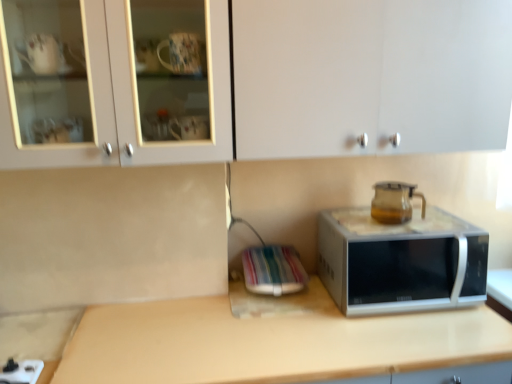
What do you see at coordinates (258, 342) in the screenshot? The width and height of the screenshot is (512, 384). I see `beige laminate countertop at center` at bounding box center [258, 342].

Describe the element at coordinates (394, 202) in the screenshot. Image resolution: width=512 pixels, height=384 pixels. I see `transparent glass coffeepot at upper right` at that location.

You are a GUI agent. You are given a task and a screenshot of the screen. Output one action in this format:
    pyautogui.click(x=<x>, y=<y>)
    Task: Click on the white glossy cabinet at upper center
    
    Given the screenshot: What is the action you would take?
    coord(254,79)

From the image's perspective, is beige laminate countertop at center under transparent glass coffeepot at upper right?

Yes, from the image's perspective, beige laminate countertop at center is beneath transparent glass coffeepot at upper right.

Between beige laminate countertop at center and transparent glass coffeepot at upper right, which one is positioned in front?

beige laminate countertop at center is closer to the camera.

Is transparent glass coffeepot at upper right at the back of beige laminate countertop at center?

beige laminate countertop at center does not have its back to transparent glass coffeepot at upper right.

What's the angular difference between white glossy cabinet at upper center and transparent glass coffeepot at upper right's facing directions?

2 degrees separate the facing orientations of white glossy cabinet at upper center and transparent glass coffeepot at upper right.

Which of these two, white glossy cabinet at upper center or transparent glass coffeepot at upper right, is smaller?

Smaller between the two is transparent glass coffeepot at upper right.

Based on the photo, considering their positions, is white glossy cabinet at upper center located in front of or behind transparent glass coffeepot at upper right?

Visually, white glossy cabinet at upper center is located in front of transparent glass coffeepot at upper right.

Which point is more forward, (x=277, y=30) or (x=406, y=205)?

The point (x=277, y=30) is in front.

Is beige laminate countertop at center to the right of silver metallic microwave at center from the viewer's perspective?

Incorrect, beige laminate countertop at center is not on the right side of silver metallic microwave at center.

Can you confirm if beige laminate countertop at center is taller than silver metallic microwave at center?

Correct, beige laminate countertop at center is much taller as silver metallic microwave at center.

From the image's perspective, which is above, beige laminate countertop at center or silver metallic microwave at center?

silver metallic microwave at center.

Looking at their sizes, would you say beige laminate countertop at center is wider or thinner than silver metallic microwave at center?

beige laminate countertop at center is wider than silver metallic microwave at center.

Consider the image. In the image, is white glossy cabinet at upper center on the left side or the right side of silver metallic microwave at center?

From the image, it's evident that white glossy cabinet at upper center is to the left of silver metallic microwave at center.

From the image's perspective, is white glossy cabinet at upper center below silver metallic microwave at center?

Actually, white glossy cabinet at upper center appears above silver metallic microwave at center in the image.

Is white glossy cabinet at upper center next to silver metallic microwave at center and touching it?

No.

Between white glossy cabinet at upper center and silver metallic microwave at center, which one is positioned in front?

white glossy cabinet at upper center is in front.

From the image's perspective, is transparent glass coffeepot at upper right on white glossy cabinet at upper center?

No, from the image's perspective, transparent glass coffeepot at upper right is not over white glossy cabinet at upper center.

Can you tell me how much transparent glass coffeepot at upper right and white glossy cabinet at upper center differ in facing direction?

There is a 2-degree angle between the facing directions of transparent glass coffeepot at upper right and white glossy cabinet at upper center.

Which object is closer to the camera, transparent glass coffeepot at upper right or white glossy cabinet at upper center?

white glossy cabinet at upper center is in front.

From a real-world perspective, is transparent glass coffeepot at upper right physically located above or below white glossy cabinet at upper center?

From a real-world perspective, transparent glass coffeepot at upper right is physically below white glossy cabinet at upper center.

Does transparent glass coffeepot at upper right have a lesser height compared to silver metallic microwave at center?

Correct, transparent glass coffeepot at upper right is not as tall as silver metallic microwave at center.

You are a GUI agent. You are given a task and a screenshot of the screen. Output one action in this format:
    pyautogui.click(x=<x>, y=<y>)
    Task: Click on the microwave oven that is under the transparent glass coffeepot at upper right (from a real-world perspective)
    This screenshot has width=512, height=384.
    Given the screenshot: What is the action you would take?
    pyautogui.click(x=401, y=261)

Is transparent glass coffeepot at upper right placed right next to silver metallic microwave at center?

No, transparent glass coffeepot at upper right is not beside silver metallic microwave at center.

From a real-world perspective, which object rests below the other?

In real-world perspective, silver metallic microwave at center is lower.

Does silver metallic microwave at center have a smaller size compared to transparent glass coffeepot at upper right?

Actually, silver metallic microwave at center might be larger than transparent glass coffeepot at upper right.

Is silver metallic microwave at center spatially inside transparent glass coffeepot at upper right, or outside of it?

silver metallic microwave at center is not enclosed by transparent glass coffeepot at upper right.

This screenshot has width=512, height=384. Find the location of `microwave oven on the right of transparent glass coffeepot at upper right`. microwave oven on the right of transparent glass coffeepot at upper right is located at coordinates 401,261.

Consider the image. Is silver metallic microwave at center aimed at transparent glass coffeepot at upper right?

No, silver metallic microwave at center is not turned towards transparent glass coffeepot at upper right.

Locate an element on the screen. countertop below the transparent glass coffeepot at upper right (from a real-world perspective) is located at coordinates (258, 342).

Where is `coffeepot located below the white glossy cabinet at upper center (from the image's perspective)`? coffeepot located below the white glossy cabinet at upper center (from the image's perspective) is located at coordinates (394, 202).

From the image, which object appears to be farther from white glossy cabinet at upper center, beige laminate countertop at center or silver metallic microwave at center?

beige laminate countertop at center lies further to white glossy cabinet at upper center than the other object.

Estimate the real-world distances between objects in this image. Which object is further from beige laminate countertop at center, white glossy cabinet at upper center or silver metallic microwave at center?

white glossy cabinet at upper center is further to beige laminate countertop at center.

Based on their spatial positions, is white glossy cabinet at upper center or silver metallic microwave at center closer to transparent glass coffeepot at upper right?

silver metallic microwave at center is closer to transparent glass coffeepot at upper right.

Estimate the real-world distances between objects in this image. Which object is closer to beige laminate countertop at center, transparent glass coffeepot at upper right or white glossy cabinet at upper center?

transparent glass coffeepot at upper right lies closer to beige laminate countertop at center than the other object.

From the image, which object appears to be nearer to transparent glass coffeepot at upper right, silver metallic microwave at center or white glossy cabinet at upper center?

silver metallic microwave at center.

Estimate the real-world distances between objects in this image. Which object is closer to transparent glass coffeepot at upper right, beige laminate countertop at center or silver metallic microwave at center?

The object closer to transparent glass coffeepot at upper right is silver metallic microwave at center.

Consider the image. Looking at the image, which one is located further to white glossy cabinet at upper center, silver metallic microwave at center or transparent glass coffeepot at upper right?

transparent glass coffeepot at upper right is positioned further to the anchor white glossy cabinet at upper center.

Based on their spatial positions, is transparent glass coffeepot at upper right or silver metallic microwave at center further from beige laminate countertop at center?

transparent glass coffeepot at upper right.

Where is `coffeepot between white glossy cabinet at upper center and beige laminate countertop at center in the up-down direction`? coffeepot between white glossy cabinet at upper center and beige laminate countertop at center in the up-down direction is located at coordinates (394, 202).

Image resolution: width=512 pixels, height=384 pixels. Find the location of `coffeepot between white glossy cabinet at upper center and silver metallic microwave at center in the horizontal direction`. coffeepot between white glossy cabinet at upper center and silver metallic microwave at center in the horizontal direction is located at coordinates (394, 202).

The height and width of the screenshot is (384, 512). Identify the location of microwave oven between white glossy cabinet at upper center and beige laminate countertop at center vertically. (401, 261).

Where is `microwave oven between transparent glass coffeepot at upper right and beige laminate countertop at center in the vertical direction`? The width and height of the screenshot is (512, 384). microwave oven between transparent glass coffeepot at upper right and beige laminate countertop at center in the vertical direction is located at coordinates (401, 261).